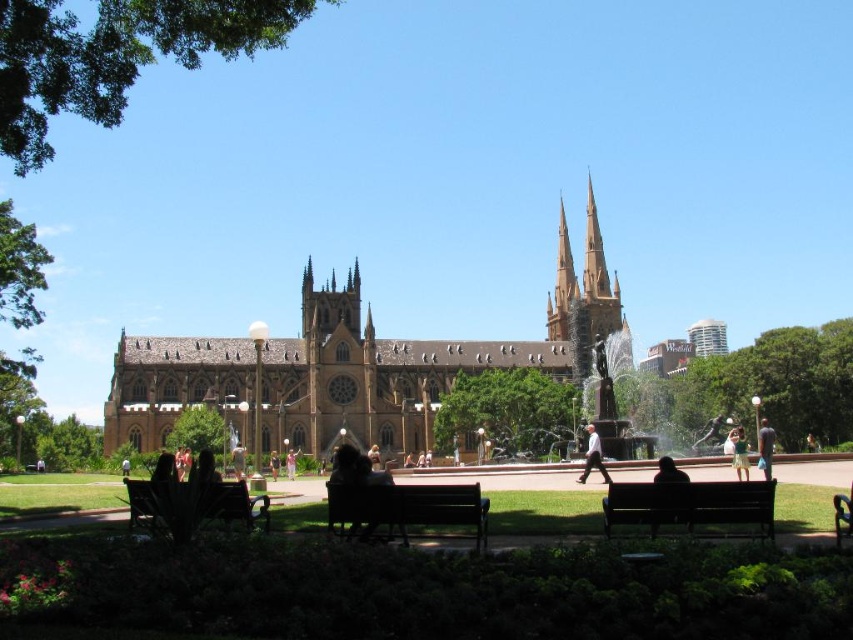
You are a photographer standing in the park and see the green fabric dress at center and the dark brown hair at lower center. Which object is located to the right of the other?

The green fabric dress at center is positioned on the right side of dark brown hair at lower center.

You are a photographer standing in the park and see both the white cotton shirt at center and the green fabric dress at center. Which clothing item is closer to you?

The white cotton shirt at center is closer to you because it is in front of the green fabric dress at center.

You are a photographer standing at the park entrance and want to capture both the white cotton shirt at center and the green fabric dress at center in the same frame. The camera you have can focus on objects within a 15 meter range. Will both subjects be in focus?

The white cotton shirt at center is 18.33 meters from the green fabric dress at center. Since the camera can only focus within 15 meters, the distance between them exceeds the camera range. Therefore, both subjects cannot be in focus simultaneously.